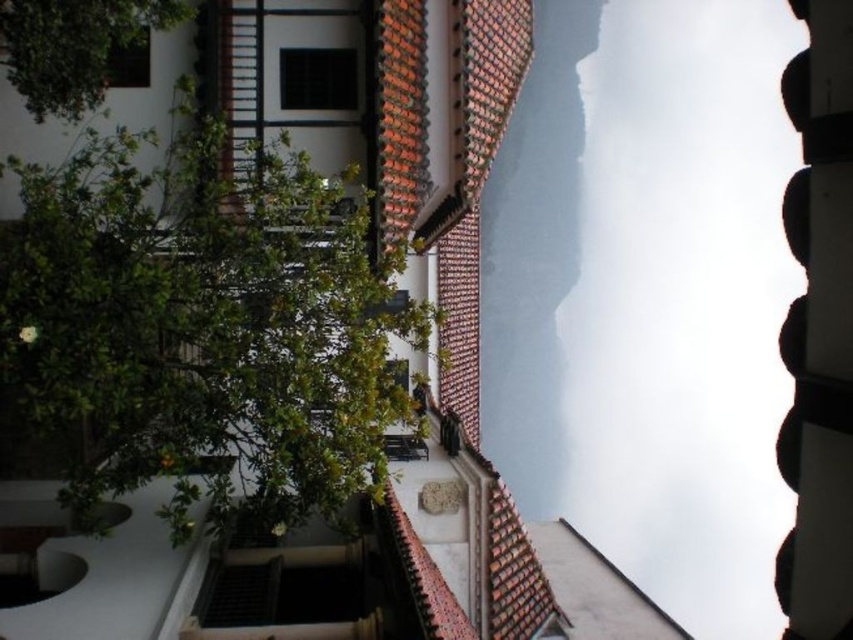
You are standing in front of the traditional building and want to know if the green leafy tree at center will block the view of the transparent glass window at upper center. Based on their sizes, can you determine if the tree is taller than the window?

The green leafy tree at center is taller than the transparent glass window at upper center, so yes, the tree is taller than the window.

You are standing in front of the traditional building with a tiled roof. There is a point marked at coordinates [202,323]. Based on the scene description, can you determine what object this point is located on?

The point at coordinates [202,323] is located on the green leafy tree at center.

You are standing at the point closer to the building in the scene. There are two points marked in the image, point A at coordinates point A is point (358,451) and point B at coordinates point B is point (119,45). Which point is closer to you?

Point A at coordinates point A is point (358,451) is closer to you because it is in front of point B at coordinates point B is point (119,45).